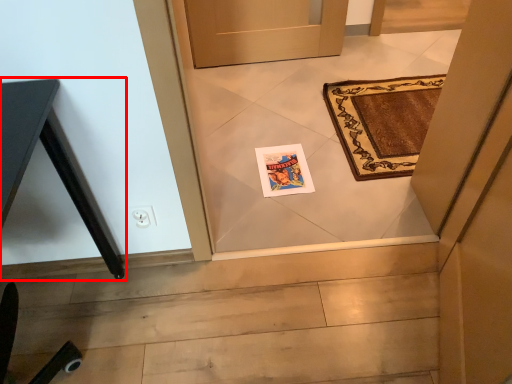
Question: From the image's perspective, where is table (annotated by the red box) located in relation to postcard in the image?

Choices:
 (A) below
 (B) above

Answer: (A)